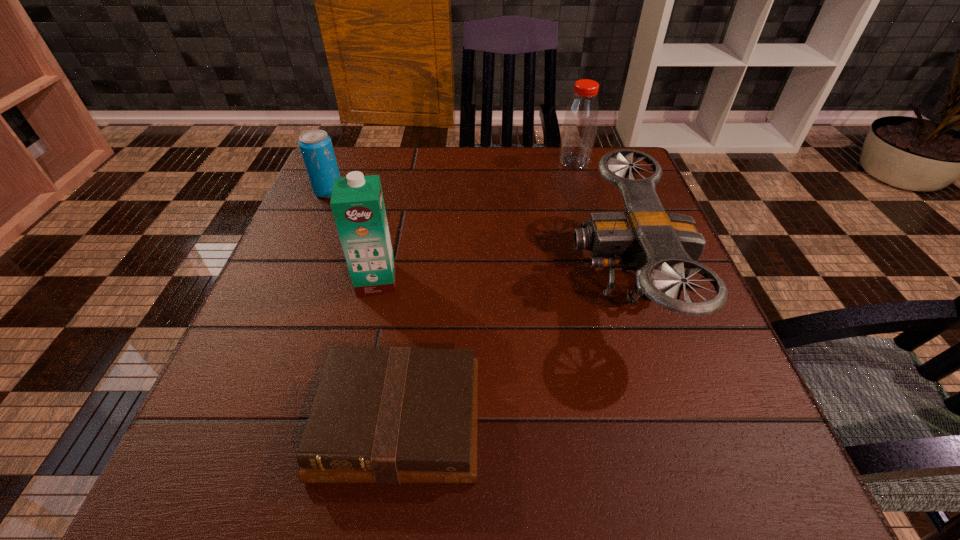
The width and height of the screenshot is (960, 540). I want to click on carton, so click(x=357, y=203).

Find the location of a particular element. The height and width of the screenshot is (540, 960). bottle is located at coordinates (581, 118).

The height and width of the screenshot is (540, 960). In order to click on the third shortest object in this screenshot , I will do `click(646, 239)`.

At what (x,y) coordinates should I click in order to perform the action: click on the second farthest object. Please return your answer as a coordinate pair (x, y). The width and height of the screenshot is (960, 540). Looking at the image, I should click on (316, 147).

Where is `the fourth tallest object`? the fourth tallest object is located at coordinates (316, 147).

Where is `Bible`? Bible is located at coordinates (395, 415).

The width and height of the screenshot is (960, 540). In order to click on vacant space located 0.300m on the back of the carton in this screenshot , I will do (x=398, y=184).

The image size is (960, 540). Find the location of `vacant area located 0.070m on the front of the farthest object`. vacant area located 0.070m on the front of the farthest object is located at coordinates (581, 185).

This screenshot has height=540, width=960. Identify the location of blank space located on the front-facing side of the third tallest object. (532, 279).

Where is `free space located 0.270m on the front-facing side of the third tallest object`? free space located 0.270m on the front-facing side of the third tallest object is located at coordinates (432, 279).